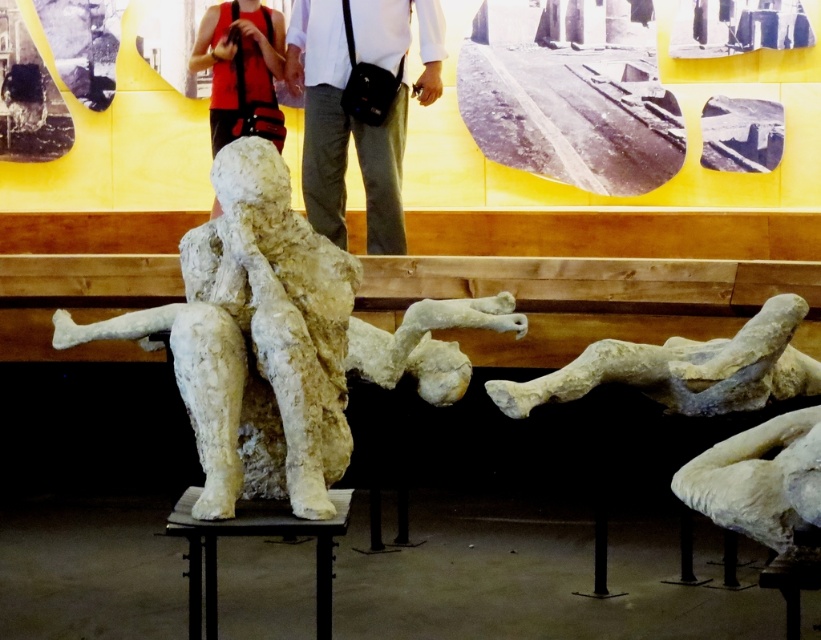
Does white stone figure at lower right appear on the right side of matte red vest at upper center?

Indeed, white stone figure at lower right is positioned on the right side of matte red vest at upper center.

Which of these two, white stone figure at lower right or matte red vest at upper center, stands taller?

matte red vest at upper center is taller.

This screenshot has width=821, height=640. What do you see at coordinates (686, 369) in the screenshot?
I see `white stone figure at lower right` at bounding box center [686, 369].

Locate an element on the screen. This screenshot has height=640, width=821. white stone figure at lower right is located at coordinates (686, 369).

Can you confirm if white stone figure at center is positioned above light gray cotton pants at center?

No.

Does white stone figure at center appear on the right side of light gray cotton pants at center?

No, white stone figure at center is not to the right of light gray cotton pants at center.

Between point (468, 307) and point (361, 168), which one is positioned behind?

Point (361, 168)

Find the location of a particular element. white stone figure at center is located at coordinates (273, 340).

Does light gray cotton pants at center have a smaller size compared to white stone figure at lower right?

No.

Is light gray cotton pants at center further to camera compared to white stone figure at lower right?

Yes.

Which is in front, point (369, 51) or point (791, 333)?

Positioned in front is point (791, 333).

The image size is (821, 640). I want to click on light gray cotton pants at center, so click(x=359, y=106).